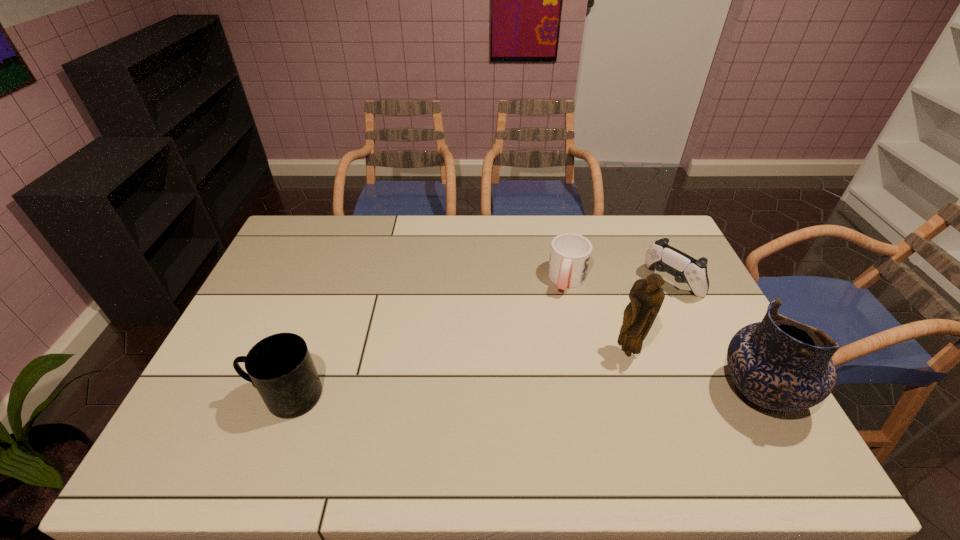
Where is `the nearer mug`? This screenshot has width=960, height=540. the nearer mug is located at coordinates (280, 366).

The width and height of the screenshot is (960, 540). I want to click on the left mug, so click(280, 366).

At what (x,y) coordinates should I click in order to perform the action: click on pottery. Please return your answer as a coordinate pair (x, y). The width and height of the screenshot is (960, 540). Looking at the image, I should click on (779, 364).

Find the location of a particular element. The width and height of the screenshot is (960, 540). figurine is located at coordinates tap(646, 295).

Locate an element on the screen. control is located at coordinates click(x=664, y=258).

Find the location of a particular element. Image resolution: width=960 pixels, height=540 pixels. the shorter mug is located at coordinates (570, 254).

Locate an element on the screen. the fourth object from right to left is located at coordinates (570, 254).

Find the location of `vacant space located on the side of the taller mug with the handle`. vacant space located on the side of the taller mug with the handle is located at coordinates (204, 396).

I want to click on vacant region located 0.140m on the side of the taller mug with the handle, so click(197, 396).

You are a GUI agent. You are given a task and a screenshot of the screen. Output one action in this format:
    pyautogui.click(x=<x>, y=<y>)
    Task: Click on the blank space located on the side of the taller mug with the handle
    
    Given the screenshot: What is the action you would take?
    pyautogui.click(x=225, y=396)